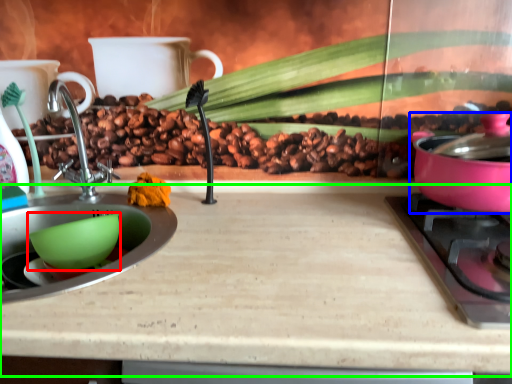
Question: Based on their relative distances, which object is nearer to mixing bowl (highlighted by a red box)? Choose from kitchen appliance (highlighted by a blue box) and counter top (highlighted by a green box).

Choices:
 (A) kitchen appliance
 (B) counter top

Answer: (B)